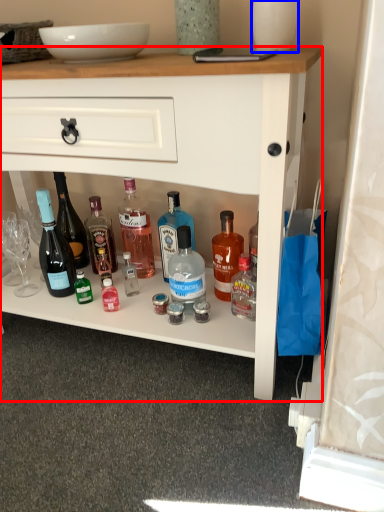
Question: Among these objects, which one is nearest to the camera, desk (highlighted by a red box) or glass vase (highlighted by a blue box)?

Choices:
 (A) desk
 (B) glass vase

Answer: (A)